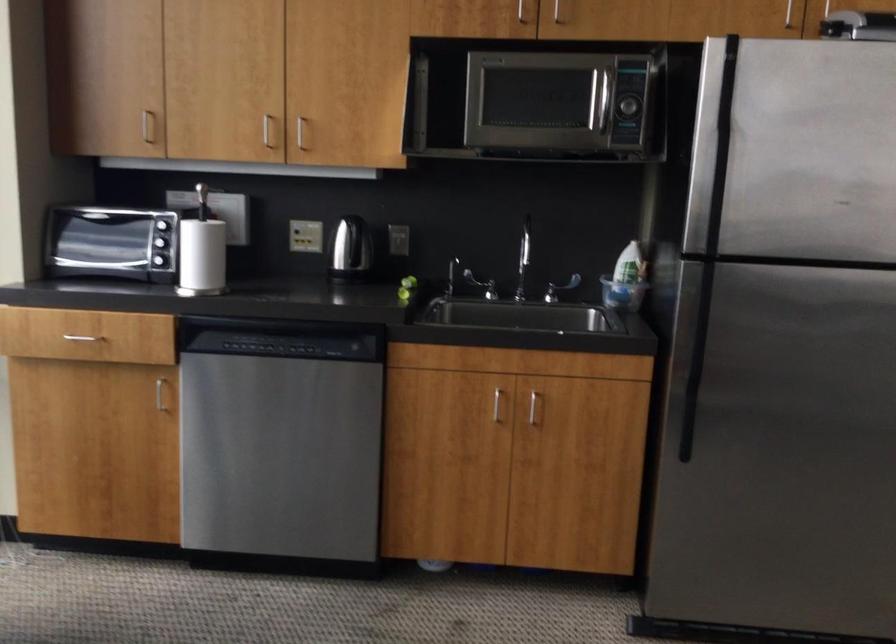
Find where to pull the dishwasher handle recess. Please return your answer as a coordinate pair (x, y).

(277, 346)